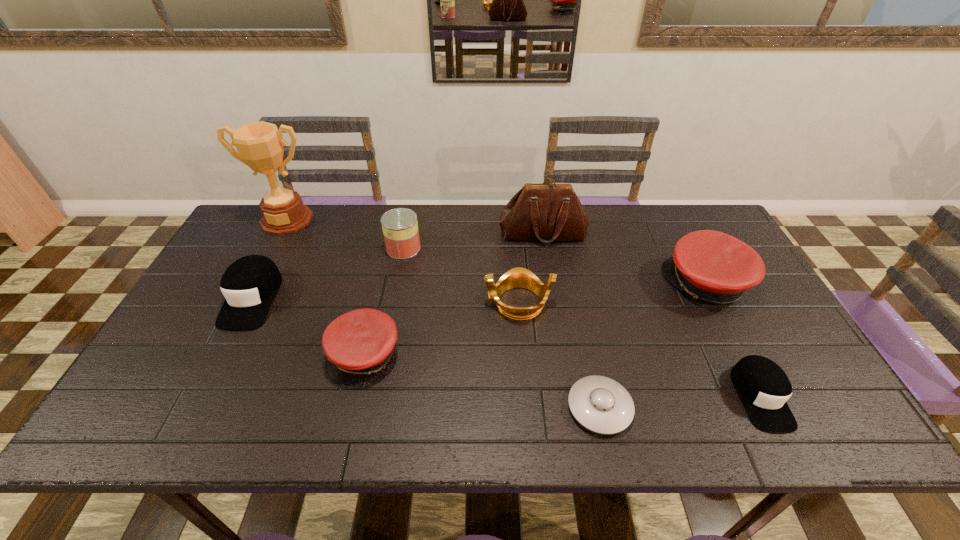
Where is `the tallest object`? Image resolution: width=960 pixels, height=540 pixels. the tallest object is located at coordinates (259, 144).

This screenshot has height=540, width=960. I want to click on the second tallest object, so click(546, 212).

Find the location of a particular element. The height and width of the screenshot is (540, 960). shoulder bag is located at coordinates (x=546, y=212).

Locate an element on the screen. The height and width of the screenshot is (540, 960). can is located at coordinates (400, 227).

I want to click on the farther red cap, so click(x=712, y=266).

What are the coordinates of `the right red cap` in the screenshot? It's located at click(x=712, y=266).

Find the location of a particular element. tiara is located at coordinates (518, 277).

Find the location of a particular element. the leftmost cap is located at coordinates (249, 285).

Where is `the left black cap`? The width and height of the screenshot is (960, 540). the left black cap is located at coordinates (249, 285).

This screenshot has height=540, width=960. In order to click on the third cap from right to left in this screenshot , I will do `click(357, 344)`.